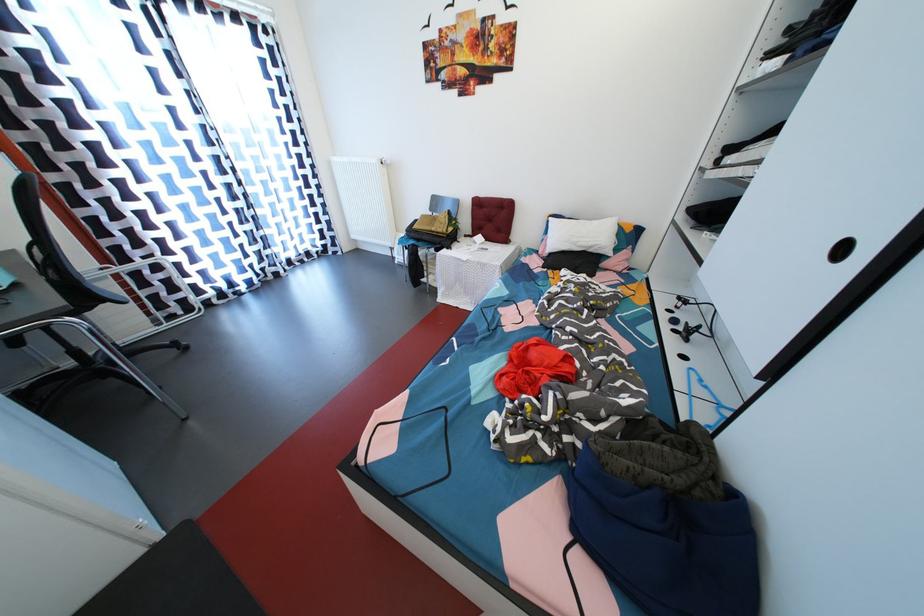
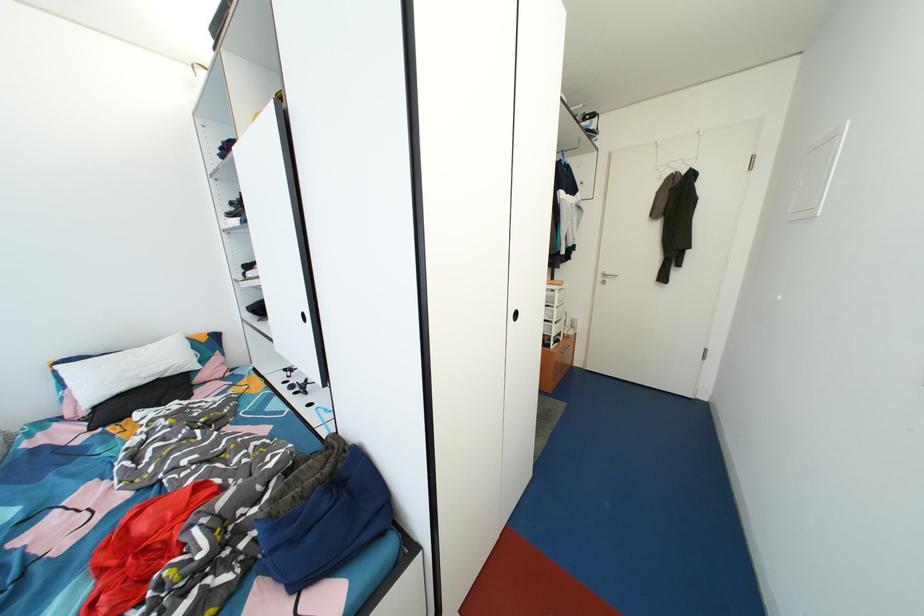
In the second image, find the point that corresponds to (x=684, y=312) in the first image.

(295, 382)